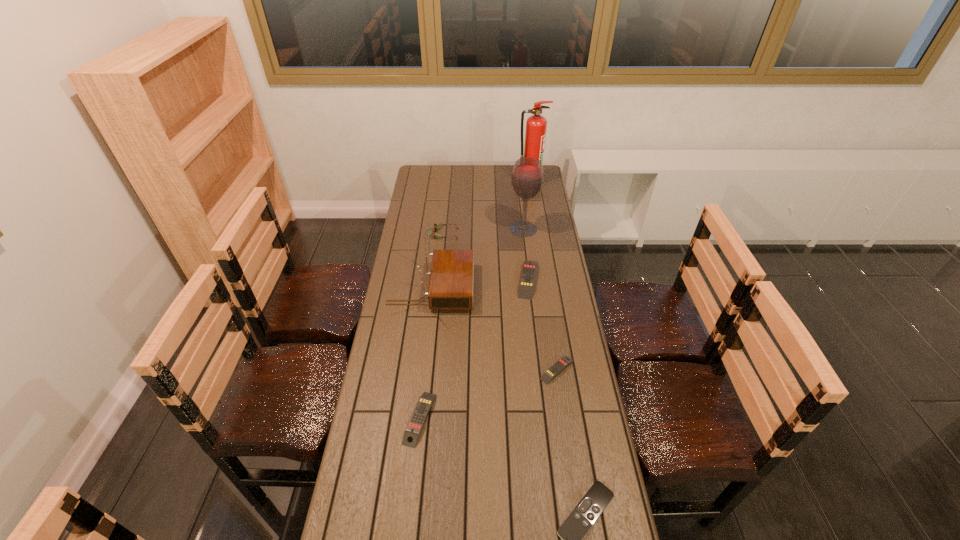
Point out which yellow remote control is positioned as the second nearest to the second smallest yellow remote control. Please provide its 2D coordinates. Your answer should be formatted as a tuple, i.e. [(x, y)], where the tuple contains the x and y coordinates of a point satisfying the conditions above.

[(529, 268)]

The width and height of the screenshot is (960, 540). Find the location of `blank space that satisfies the following two spatial constraints: 1. on the front panel of the radio_receiver; 2. on the right side of the third shortest object`. blank space that satisfies the following two spatial constraints: 1. on the front panel of the radio_receiver; 2. on the right side of the third shortest object is located at coordinates (417, 419).

Image resolution: width=960 pixels, height=540 pixels. What are the coordinates of `free space in the image that satisfies the following two spatial constraints: 1. on the back side of the third nearest object; 2. on the front-facing side of the fourth tallest object` in the screenshot? It's located at (537, 234).

Identify the location of vacant space that satisfies the following two spatial constraints: 1. with the nozzle pointing from the back of the fire extinguisher; 2. on the front-facing side of the fifth shortest object. (539, 234).